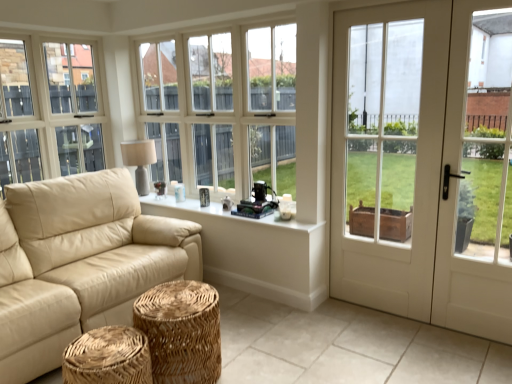
Question: Is white matte window sill at center, acting as the 2th window sill starting from the top, bigger or smaller than matte beige lampshade at upper left?

Choices:
 (A) big
 (B) small

Answer: (B)

Question: Does point (302, 259) appear closer or farther from the camera than point (142, 142)?

Choices:
 (A) farther
 (B) closer

Answer: (B)

Question: Estimate the real-world distances between objects in this image. Which object is closer to the woven natural stool at lower center, the first stool viewed from the front?

Choices:
 (A) beige leather couch at left
 (B) matte beige lampshade at upper left
 (C) white glossy door at right
 (D) white glass door at right
 (E) white wood window at center

Answer: (A)

Question: Estimate the real-world distances between objects in this image. Which object is closer to the woven natural stool at center, placed as the second stool when sorted from front to back?

Choices:
 (A) white glossy door at right
 (B) woven natural stool at lower center, which ranks as the 2th stool in back-to-front order
 (C) white matte window sill at center, placed as the 1th window sill when sorted from bottom to top
 (D) matte beige lampshade at upper left
 (E) white wood window at center

Answer: (B)